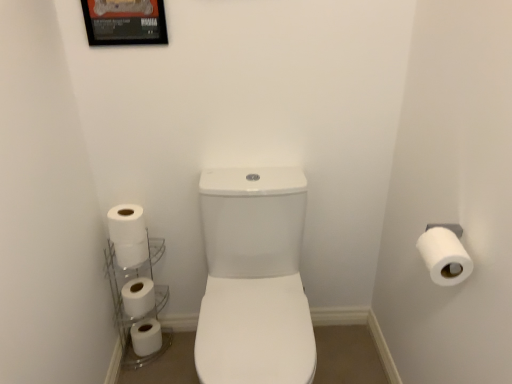
This screenshot has width=512, height=384. Find the location of `vacant region to the right of clear glass shelves at lower left`. vacant region to the right of clear glass shelves at lower left is located at coordinates (182, 352).